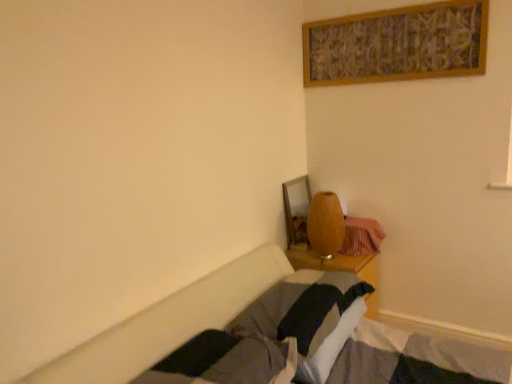
Question: Is the position of soft gray pillow at center less distant than that of plaid fabric blanket at lower right?

Choices:
 (A) yes
 (B) no

Answer: (A)

Question: From a real-world perspective, is soft gray pillow at center physically above plaid fabric blanket at lower right?

Choices:
 (A) no
 (B) yes

Answer: (A)

Question: Is soft gray pillow at center at the left side of plaid fabric blanket at lower right?

Choices:
 (A) yes
 (B) no

Answer: (A)

Question: Can you confirm if soft gray pillow at center is wider than plaid fabric blanket at lower right?

Choices:
 (A) yes
 (B) no

Answer: (A)

Question: From a real-world perspective, is soft gray pillow at center physically below plaid fabric blanket at lower right?

Choices:
 (A) yes
 (B) no

Answer: (A)

Question: Is soft gray pillow at center facing towards plaid fabric blanket at lower right?

Choices:
 (A) yes
 (B) no

Answer: (B)

Question: Can you confirm if matte yellow lamp at center is thinner than plaid fabric blanket at lower right?

Choices:
 (A) no
 (B) yes

Answer: (B)

Question: Would you say matte yellow lamp at center is a long distance from plaid fabric blanket at lower right?

Choices:
 (A) no
 (B) yes

Answer: (A)

Question: From a real-world perspective, is matte yellow lamp at center on plaid fabric blanket at lower right?

Choices:
 (A) no
 (B) yes

Answer: (B)

Question: Does matte yellow lamp at center have a greater width compared to plaid fabric blanket at lower right?

Choices:
 (A) yes
 (B) no

Answer: (B)

Question: Could you tell me if matte yellow lamp at center is turned towards plaid fabric blanket at lower right?

Choices:
 (A) yes
 (B) no

Answer: (B)

Question: Does matte yellow lamp at center have a lesser height compared to plaid fabric blanket at lower right?

Choices:
 (A) no
 (B) yes

Answer: (A)

Question: Is plaid fabric blanket at lower right to the right of matte yellow lamp at center from the viewer's perspective?

Choices:
 (A) yes
 (B) no

Answer: (A)